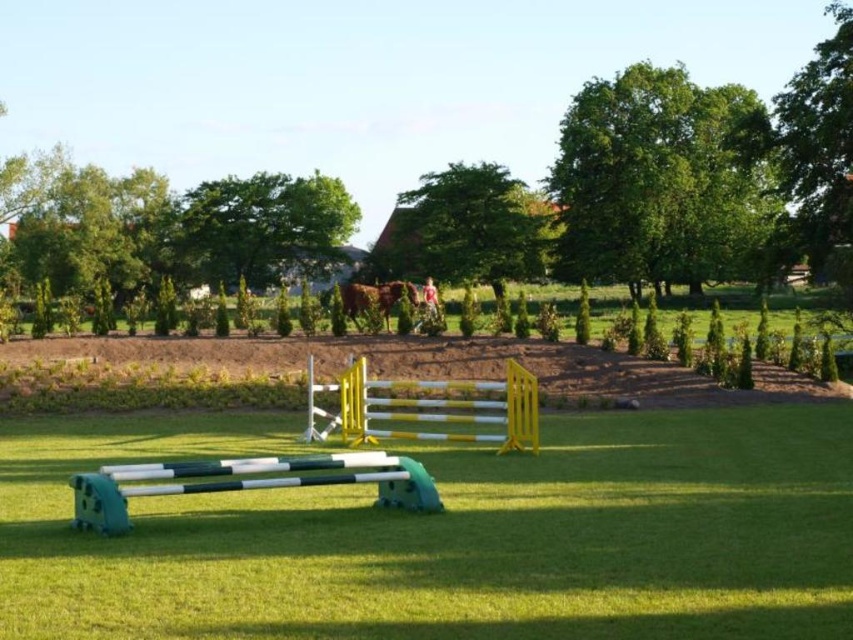
You are a rider observing the equestrian area. You see the green grass at center and the brown glossy horse at center. Which object is positioned to the right of the other?

The green grass at center is to the right of the brown glossy horse at center.